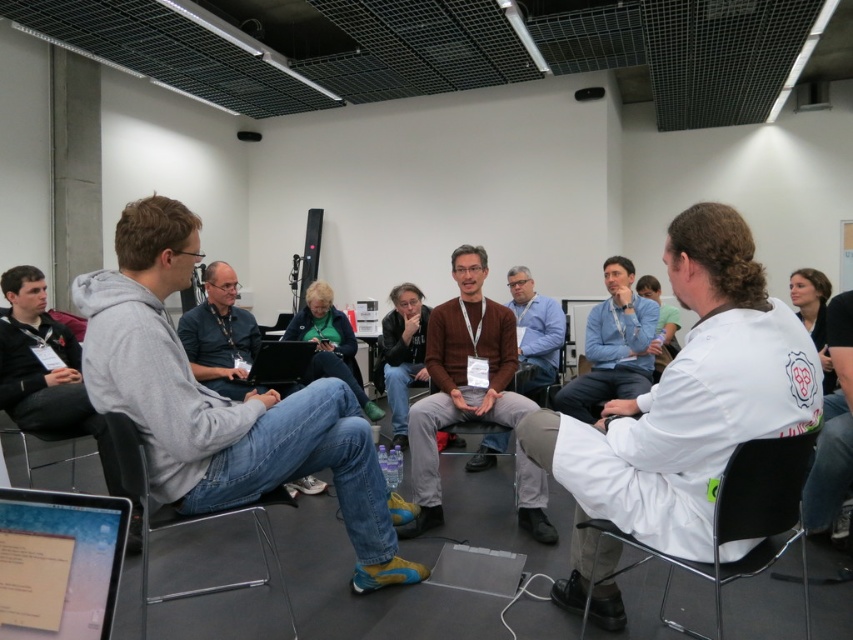
Is gray hoodie at center to the left of black matte laptop at center from the viewer's perspective?

In fact, gray hoodie at center is to the right of black matte laptop at center.

Between gray hoodie at center and black matte laptop at center, which one has less height?

black matte laptop at center is shorter.

Locate an element on the screen. gray hoodie at center is located at coordinates (222, 401).

Which is in front, point (21, 314) or point (138, 474)?

Point (138, 474) is in front.

Does dark gray hoodie at left have a smaller size compared to clear plastic chair at lower left?

No.

What do you see at coordinates (50, 378) in the screenshot? I see `dark gray hoodie at left` at bounding box center [50, 378].

This screenshot has width=853, height=640. In order to click on dark gray hoodie at left in this screenshot , I will do `click(50, 378)`.

Between point (669, 467) and point (618, 273), which one is positioned in front?

Positioned in front is point (669, 467).

Is point (569, 426) closer to viewer compared to point (651, 317)?

Yes, it is.

I want to click on white lab coat at center, so click(689, 397).